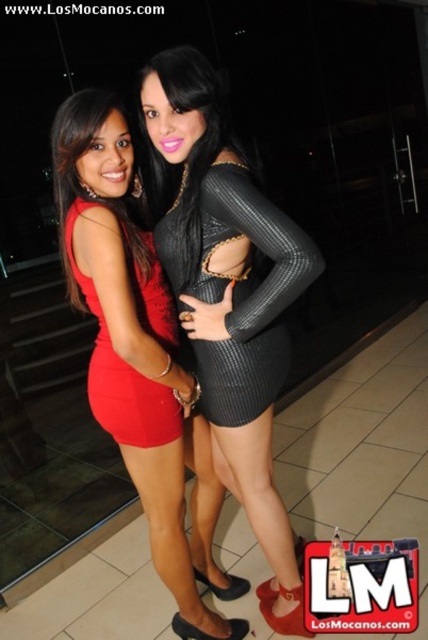
Question: Which object is positioned farthest from the matte red dress at left?

Choices:
 (A) matte black dress at center
 (B) shiny black dress at center
 (C) black ribbed dress at center

Answer: (B)

Question: Does shiny black dress at center have a larger size compared to matte red dress at left?

Choices:
 (A) yes
 (B) no

Answer: (A)

Question: Is shiny black dress at center smaller than matte red dress at left?

Choices:
 (A) yes
 (B) no

Answer: (B)

Question: Observing the image, what is the correct spatial positioning of shiny black dress at center in reference to matte black dress at center?

Choices:
 (A) below
 (B) above

Answer: (B)

Question: Which of the following is the closest to the observer?

Choices:
 (A) (162, 403)
 (B) (199, 134)
 (C) (303, 237)
 (D) (148, 492)

Answer: (C)

Question: Which of the following is the farthest from the observer?

Choices:
 (A) (163, 518)
 (B) (241, 323)

Answer: (A)